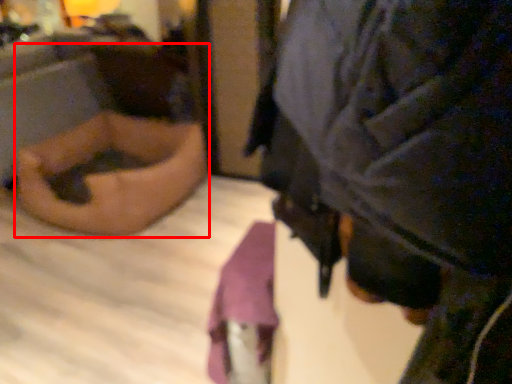
Question: Observing the image, what is the correct spatial positioning of person (annotated by the red box) in reference to person?

Choices:
 (A) left
 (B) right

Answer: (A)